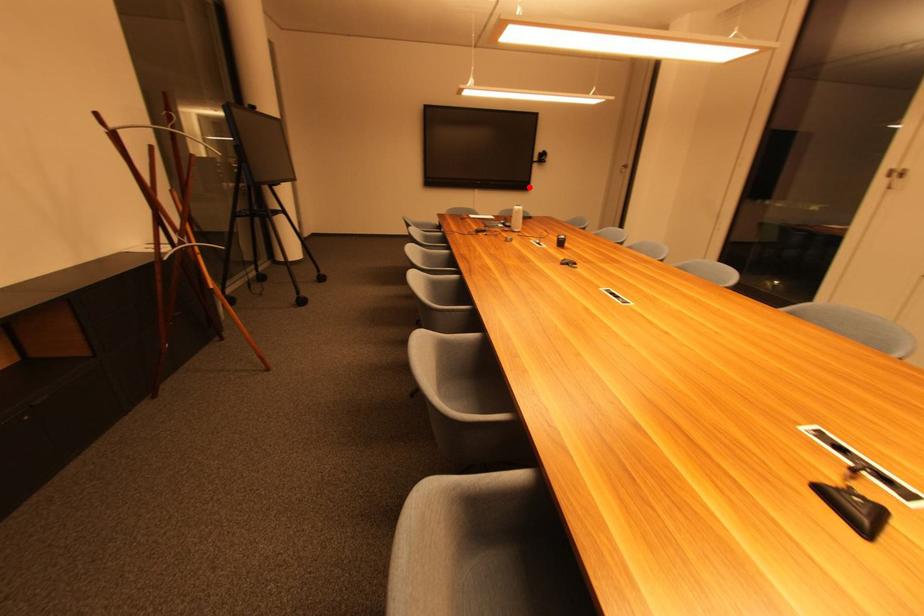
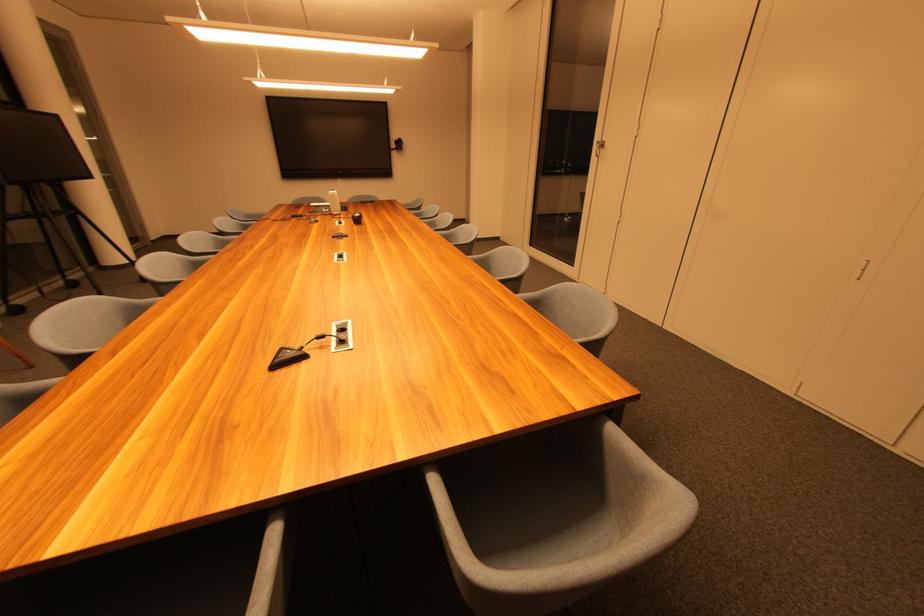
Find the pixel in the second image that matches the highlighted location in the first image.

(391, 175)